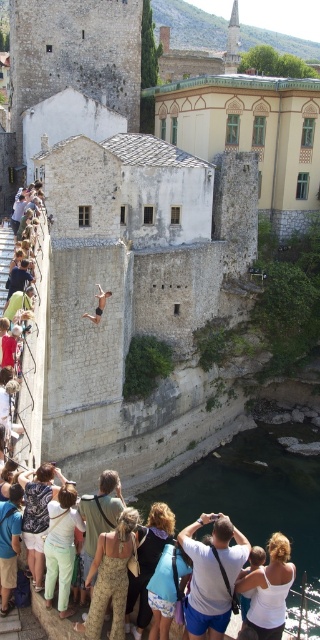
Does point (200, 621) lie in front of point (24, 506)?

Yes, it is.

Is point (202, 592) farther from viewer compared to point (22, 474)?

No, (202, 592) is closer to viewer.

You are a GUI agent. You are given a task and a screenshot of the screen. Output one action in this format:
    pyautogui.click(x=<x>, y=<y>)
    Task: Click on the white cotton shirt at center
    The height and width of the screenshot is (640, 320).
    Given the screenshot: What is the action you would take?
    pyautogui.click(x=211, y=573)

Does denim shorts at center appear on the left side of smooth black swimmer at center?

No, denim shorts at center is not to the left of smooth black swimmer at center.

Between denim shorts at center and smooth black swimmer at center, which one is positioned lower?

denim shorts at center is lower down.

Does point (160, 525) lie in front of point (84, 314)?

Yes.

You are a GUI agent. You are given a task and a screenshot of the screen. Output one action in this format:
    pyautogui.click(x=<x>, y=<y>)
    Task: Click on the denim shorts at center
    Image resolution: width=320 pixels, height=640 pixels.
    Given the screenshot: What is the action you would take?
    pyautogui.click(x=148, y=563)

In the scene shown: Which is above, denim shorts at center or camouflage backpack at center?

camouflage backpack at center is above.

Between point (149, 550) and point (34, 525), which one is positioned in front?

Positioned in front is point (149, 550).

At what (x,y) coordinates should I click in order to perform the action: click on denim shorts at center. Please return your answer as a coordinate pair (x, y). Looking at the image, I should click on (148, 563).